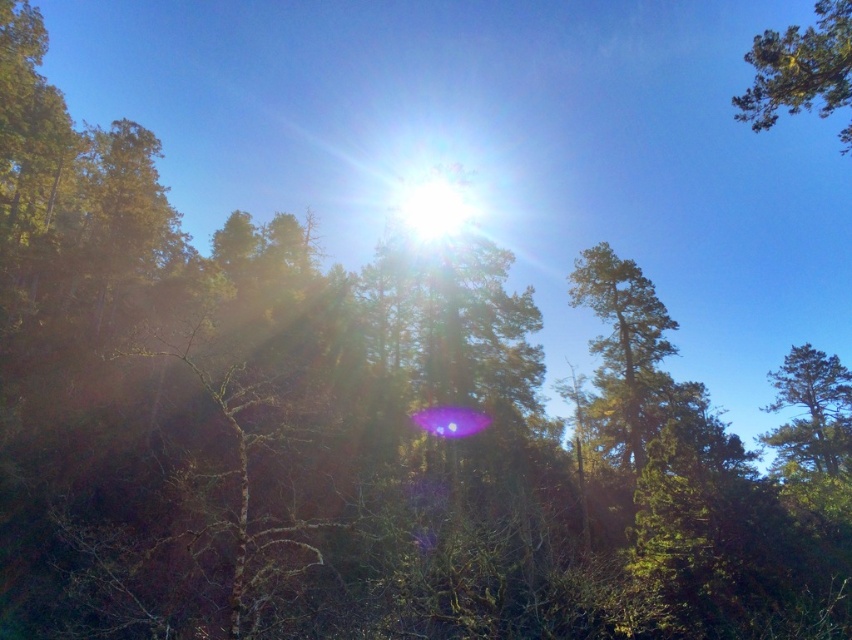
Question: Is green textured tree at upper right smaller than green leafy tree at right?

Choices:
 (A) no
 (B) yes

Answer: (A)

Question: Does green textured tree at upper right appear on the left side of green leafy tree at right?

Choices:
 (A) yes
 (B) no

Answer: (A)

Question: Which object is farther from the camera taking this photo?

Choices:
 (A) green textured tree at upper right
 (B) green leafy tree at right

Answer: (B)

Question: Does green textured tree at upper right appear over green leafy tree at right?

Choices:
 (A) no
 (B) yes

Answer: (B)

Question: Which of the following is the farthest from the observer?

Choices:
 (A) green leafy tree at right
 (B) green textured tree at upper right

Answer: (A)